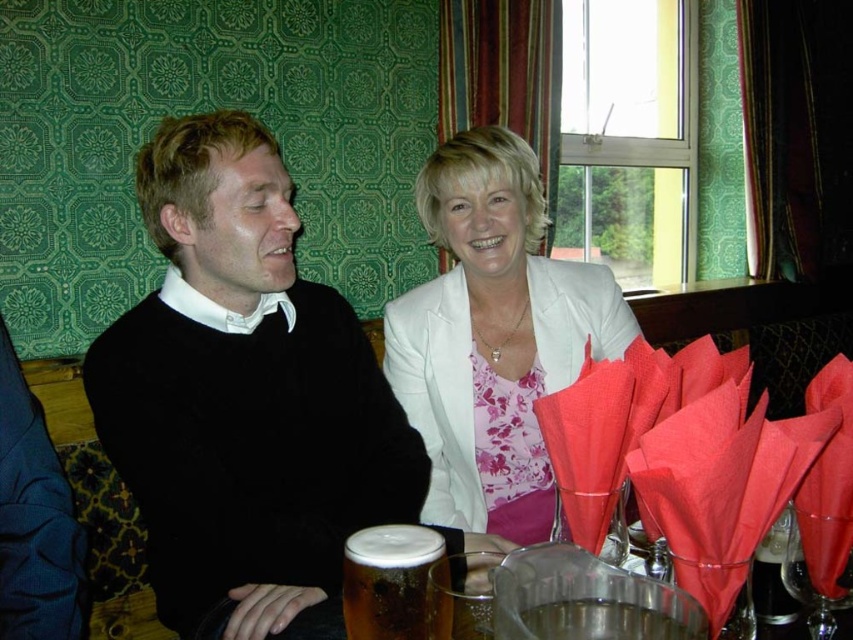
Is white satin blazer at center wider than foamy amber liquid at lower center?

Yes.

Between white satin blazer at center and foamy amber liquid at lower center, which one appears on the right side from the viewer's perspective?

white satin blazer at center

Which is behind, point (547, 385) or point (358, 550)?

Point (547, 385)

At what (x,y) coordinates should I click in order to perform the action: click on white satin blazer at center. Please return your answer as a coordinate pair (x, y). Image resolution: width=853 pixels, height=640 pixels. Looking at the image, I should click on (492, 337).

Which is below, foamy amber liquid at lower center or translucent glass beer at center?

translucent glass beer at center

Is point (387, 600) positioned behind point (611, 628)?

Yes, it is.

The image size is (853, 640). What are the coordinates of `foamy amber liquid at lower center` in the screenshot? It's located at (393, 582).

Does white satin blazer at center lie behind translucent glass beer at center?

Yes, white satin blazer at center is further from the viewer.

Does white satin blazer at center appear on the left side of translucent glass beer at center?

Correct, you'll find white satin blazer at center to the left of translucent glass beer at center.

Which is behind, point (463, 234) or point (608, 609)?

Point (463, 234)

Where is `white satin blazer at center`? white satin blazer at center is located at coordinates (492, 337).